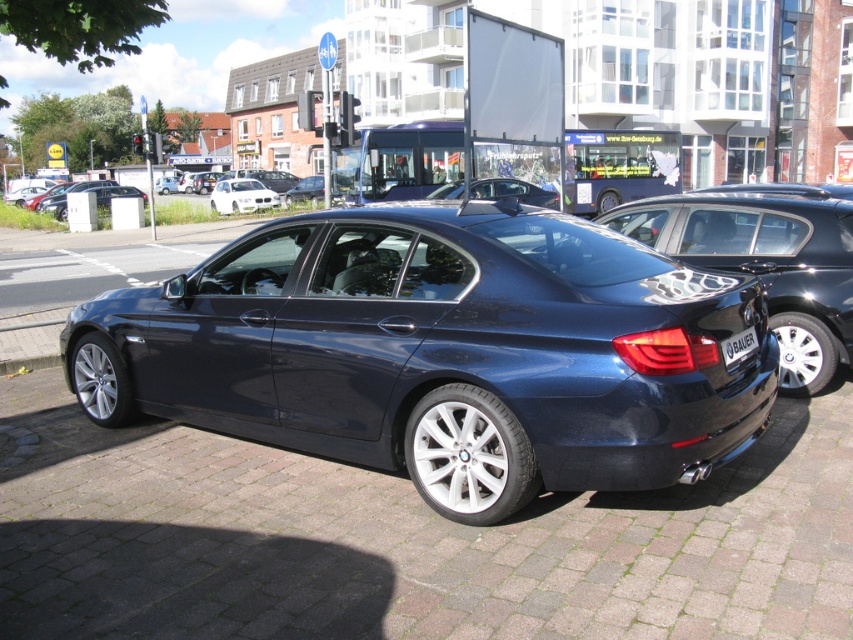
Based on the photo, you are a delivery person needing to park your van between the glossy dark blue sedan at center and the white glossy sedan at upper center. The van is 20 feet long. Can you fit it between them?

The distance between the glossy dark blue sedan at center and the white glossy sedan at upper center is 89.16 feet. Since the van is only 20 feet long, there is sufficient space to park it between them.

You are a delivery driver who needs to park your van between the glossy dark blue sedan at center and the white glossy sedan at upper center. Can you fit your van, which is 2 meters wide, in the available space between them?

The glossy dark blue sedan at center is to the right of white glossy sedan at upper center, but the exact distance between them is not provided. Without knowing the space between the two sedans, it is impossible to determine if the van can fit.